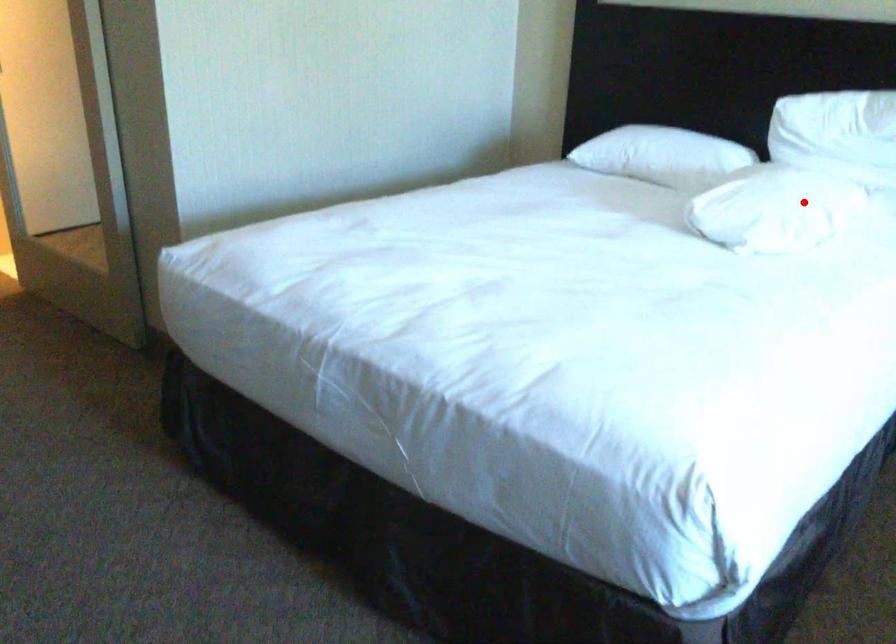
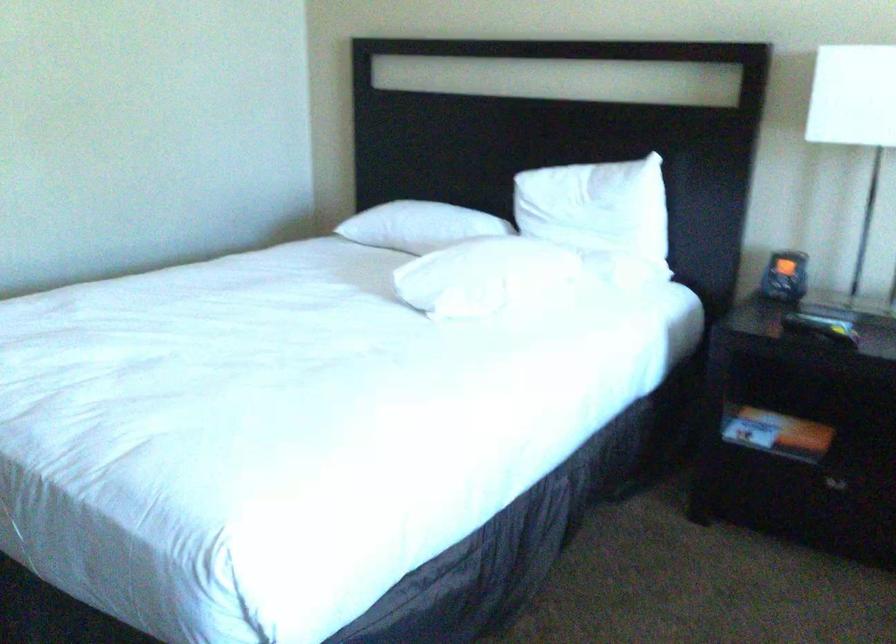
Find the pixel in the second image that matches the highlighted location in the first image.

(485, 276)